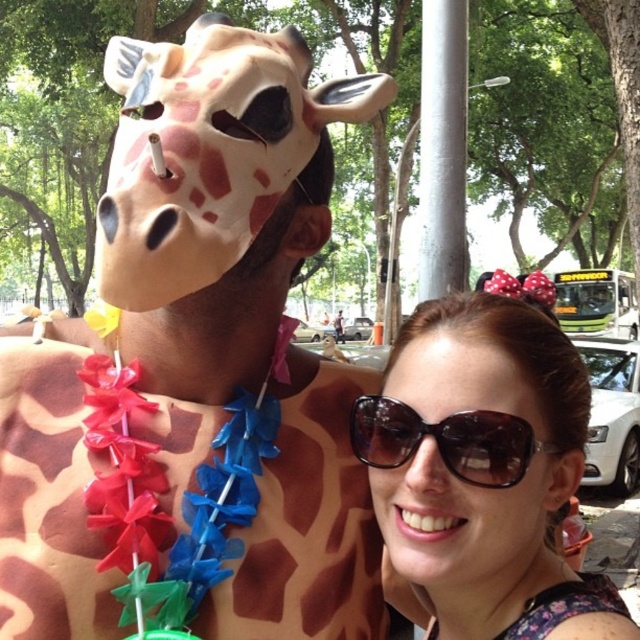
Question: From the image, what is the correct spatial relationship of matte black sunglasses at upper center in relation to silver metallic pole at upper center?

Choices:
 (A) below
 (B) above

Answer: (A)

Question: Does matte black sunglasses at upper center appear over brown matte sunglasses at center?

Choices:
 (A) no
 (B) yes

Answer: (A)

Question: Which object is the farthest from the brown matte sunglasses at center?

Choices:
 (A) brown matte giraffe mask at upper left
 (B) matte black sunglasses at upper center
 (C) silver metallic pole at upper center

Answer: (C)

Question: Which point is farther to the camera?

Choices:
 (A) (500, 444)
 (B) (540, 586)

Answer: (B)

Question: Which point appears closest to the camera in this image?

Choices:
 (A) (454, 132)
 (B) (620, 625)
 (C) (508, 468)
 (D) (324, 500)

Answer: (C)

Question: Is matte black sunglasses at upper center to the right of silver metallic pole at upper center from the viewer's perspective?

Choices:
 (A) no
 (B) yes

Answer: (A)